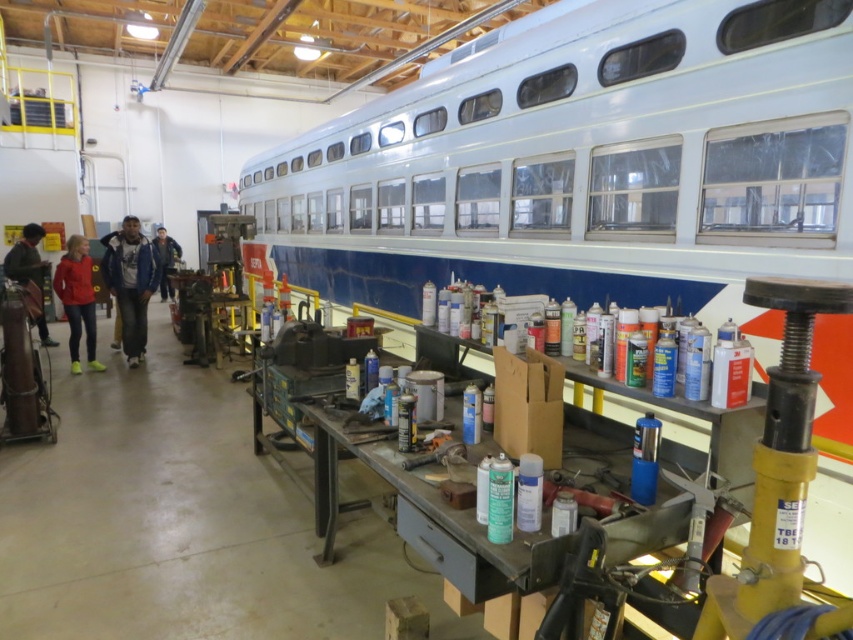
Question: Among these objects, which one is farthest from the camera?

Choices:
 (A) blue jeans at center
 (B) matte red jacket at center
 (C) blue denim jacket at center

Answer: (A)

Question: Does matte black jacket at left have a smaller size compared to metallic silver tool at center?

Choices:
 (A) no
 (B) yes

Answer: (A)

Question: Which point is closer to the camera?

Choices:
 (A) (59, 275)
 (B) (437, 445)
 (C) (141, 339)
 (D) (22, 253)

Answer: (B)

Question: Does matte black jacket at left have a smaller size compared to blue jeans at center?

Choices:
 (A) yes
 (B) no

Answer: (A)

Question: In this image, where is blue denim jacket at center located relative to metallic silver tool at center?

Choices:
 (A) right
 (B) left

Answer: (B)

Question: Among these objects, which one is farthest from the camera?

Choices:
 (A) matte black jacket at left
 (B) matte red jacket at center
 (C) blue denim jacket at center
 (D) blue jeans at center

Answer: (D)